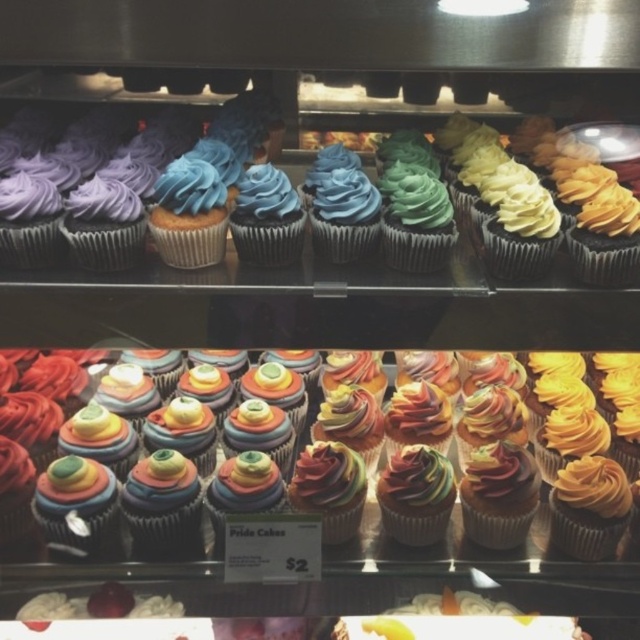
You are standing in front of the display case and want to reach the point at coordinates (x=141, y=177). The display case is 3.72 feet away from you. If your hand can extend 3 feet forward, can you reach that point?

The point at coordinates (x=141, y=177) is 3.72 feet away from you. Since your hand can only extend 3 feet forward, you cannot reach that point.

You are standing in front of the display case and want to find the matte chocolate cupcake at center. Based on its coordinates, which shelf is it on?

The matte chocolate cupcake at center is located at point coordinates (243, 220), so it is on the bottom shelf since the bottom shelf is lower in the image.

You are a customer looking at the cupcakes in the display case. There are two points marked in the image. The first point is at coordinate point (413, 182) and the second point is at coordinate point (465, 433). Which point is closer to you as you look at the display case?

Point (413, 182) is closer to you because it is in front of point (465, 433) in the display case.